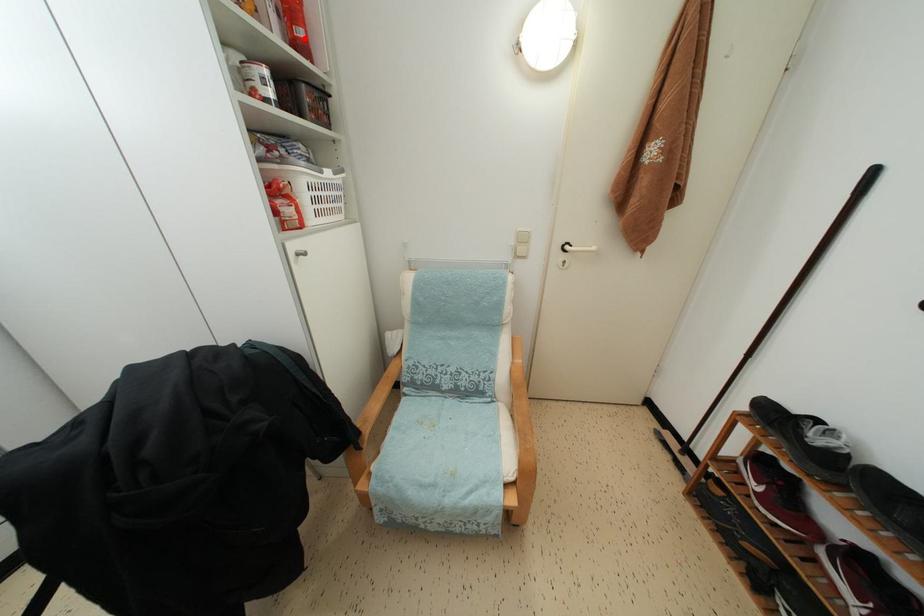
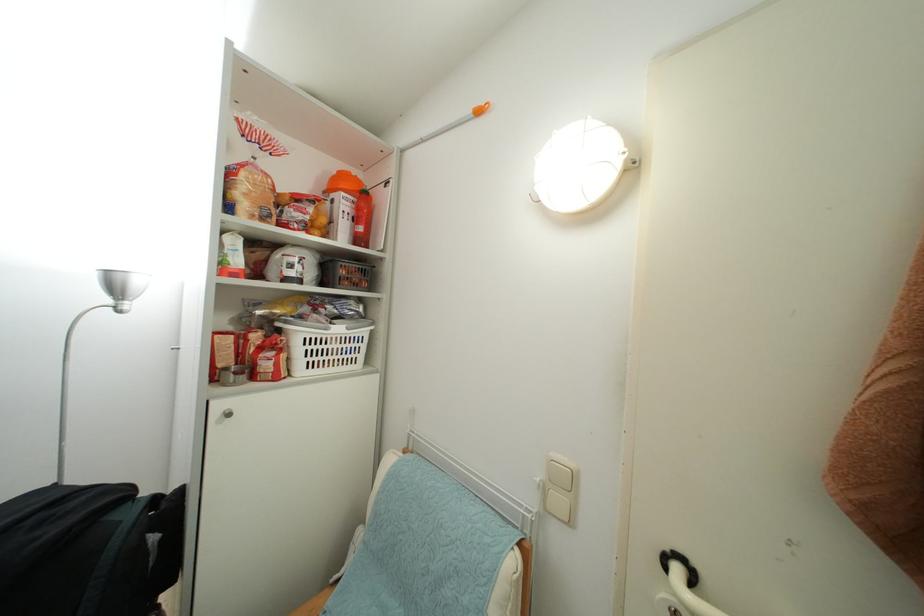
Locate, in the second image, the point that corresponds to the highlighted location in the first image.

(365, 235)